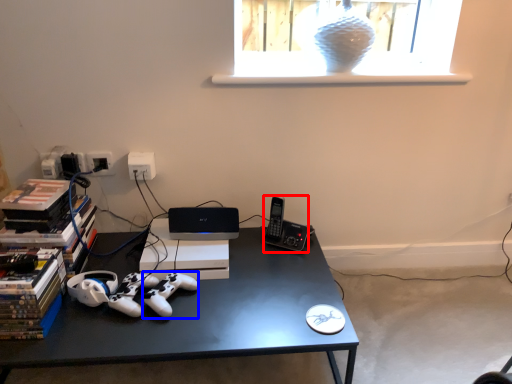
Question: Which object is further to the camera taking this photo, gadget (highlighted by a red box) or game controller (highlighted by a blue box)?

Choices:
 (A) gadget
 (B) game controller

Answer: (A)